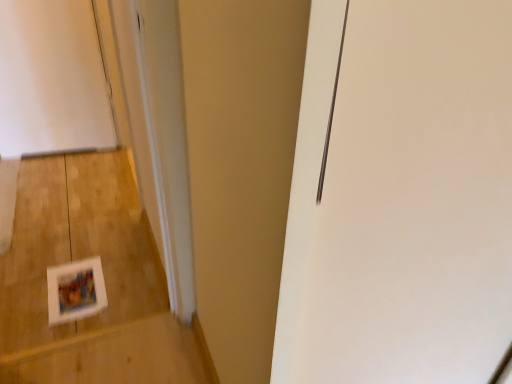
Image resolution: width=512 pixels, height=384 pixels. In order to click on vacant location behind matte white postcard at lower left in this screenshot , I will do `click(95, 243)`.